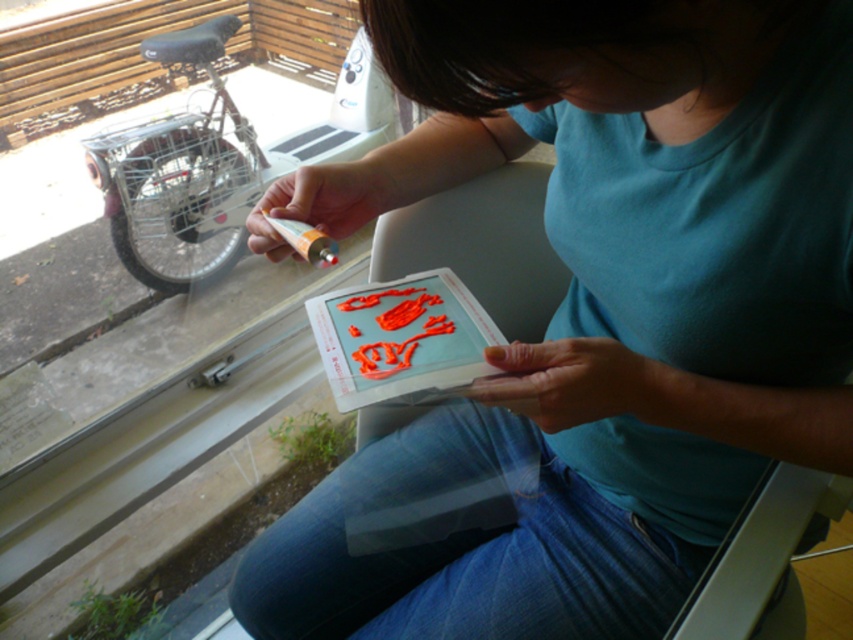
Question: Is matte orange marker at center to the left of glossy plastic card at center from the viewer's perspective?

Choices:
 (A) no
 (B) yes

Answer: (A)

Question: Is matte orange marker at center thinner than glossy plastic card at center?

Choices:
 (A) yes
 (B) no

Answer: (B)

Question: Among these objects, which one is farthest from the camera?

Choices:
 (A) matte orange marker at center
 (B) glossy plastic card at center

Answer: (B)

Question: Which of the following is the closest to the observer?

Choices:
 (A) (358, 330)
 (B) (788, 416)

Answer: (B)

Question: Does matte orange marker at center have a larger size compared to glossy plastic card at center?

Choices:
 (A) no
 (B) yes

Answer: (B)